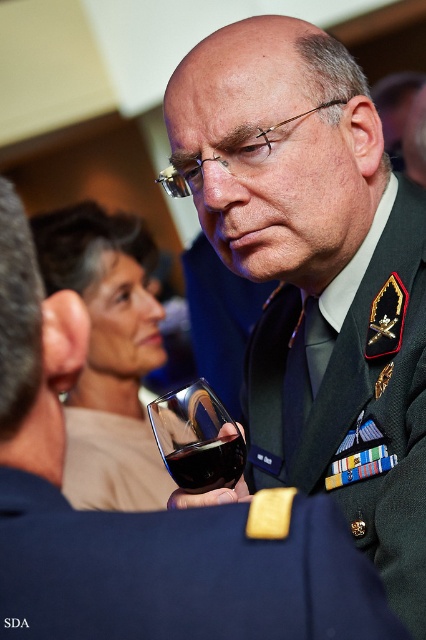
Based on the scene description, which object is positioned higher in the image between the green military uniform at center and the navy blue fabric at center?

The green military uniform at center is positioned above the navy blue fabric at center according to the description.

You are a photographer at the event and need to ensure both the navy blue fabric at center and the transparent glass at center are visible in your photo. Which object should you focus on to capture both clearly, considering their sizes?

The navy blue fabric at center has a larger size compared to the transparent glass at center, so focusing on the navy blue fabric at center would ensure both are visible in the photo.

You are a photographer at the event and need to ensure that both the green military uniform at center and the dark red liquid at center are clearly visible in your photo. Given their sizes, which object should you focus on to ensure both are in focus?

The green military uniform at center has a larger size compared to the dark red liquid at center, so focusing on the larger object, the green military uniform at center, will ensure both are in focus since depth of field is greater for larger objects.